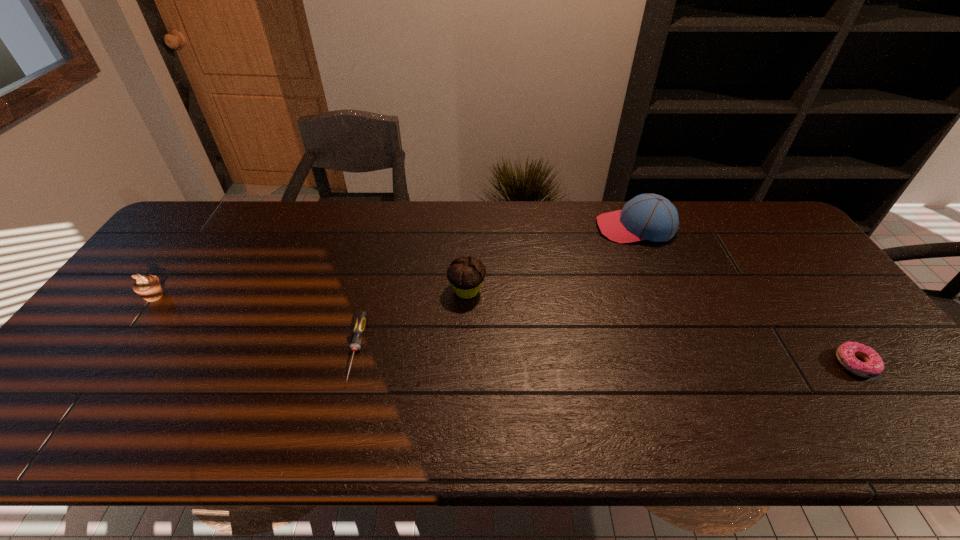
Locate an element on the screen. This screenshot has width=960, height=540. vacant area that lies between the third tallest object and the baseball cap is located at coordinates (395, 262).

Locate an element on the screen. This screenshot has width=960, height=540. free space between the third object from left to right and the fourth object from right to left is located at coordinates (412, 320).

Identify the location of free area in between the baseball cap and the rightmost object. The width and height of the screenshot is (960, 540). (745, 296).

Select which object is the third closest to the third shortest object. Please provide its 2D coordinates. Your answer should be formatted as a tuple, i.e. [(x, y)], where the tuple contains the x and y coordinates of a point satisfying the conditions above.

[(652, 217)]

Locate which object ranks second in proximity to the second shortest object. Please provide its 2D coordinates. Your answer should be formatted as a tuple, i.e. [(x, y)], where the tuple contains the x and y coordinates of a point satisfying the conditions above.

[(466, 275)]

Identify the location of vacant space that satisfies the following two spatial constraints: 1. on the front-facing side of the farthest object; 2. on the back side of the doughnut. The height and width of the screenshot is (540, 960). (691, 364).

This screenshot has width=960, height=540. What are the coordinates of `free spot that satisfies the following two spatial constraints: 1. insert the second object from left to right into a screw head; 2. on the right side of the second shortest object` in the screenshot? It's located at (353, 364).

Find the location of a particular element. This screenshot has height=540, width=960. vacant space that satisfies the following two spatial constraints: 1. insert the rightmost object into a screw head; 2. on the left side of the fourth object from right to left is located at coordinates [353, 364].

You are a GUI agent. You are given a task and a screenshot of the screen. Output one action in this format:
    pyautogui.click(x=<x>, y=<y>)
    Task: Click on the free point that satisfies the following two spatial constraints: 1. on the front side of the right muffin; 2. on the left side of the doughnut
    The image size is (960, 540).
    Given the screenshot: What is the action you would take?
    pyautogui.click(x=465, y=364)

Find the location of a particular element. free space that satisfies the following two spatial constraints: 1. on the front-facing side of the baseball cap; 2. insert the screwdriver into a screw head is located at coordinates (685, 350).